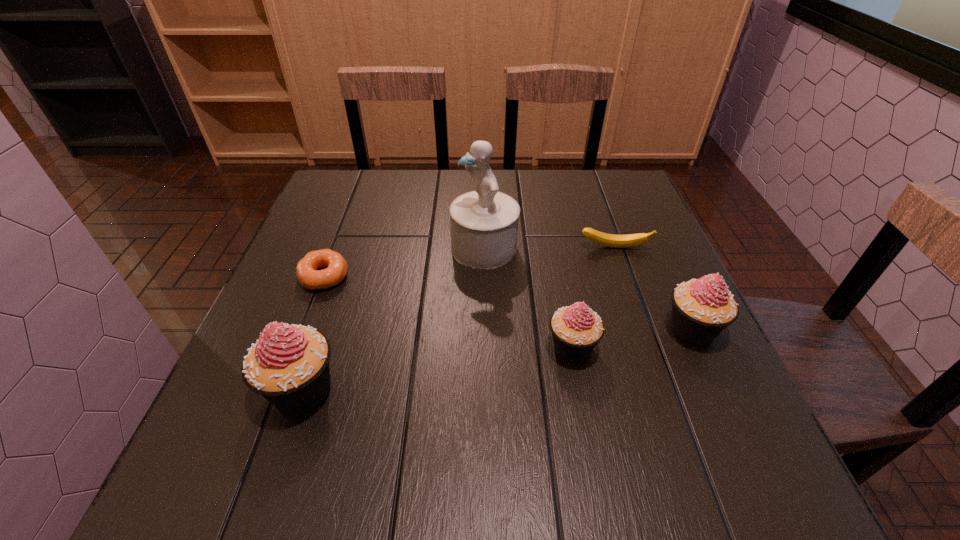
In order to click on free space for an extra cupcake to achieve even spacing in this screenshot , I will do `click(443, 368)`.